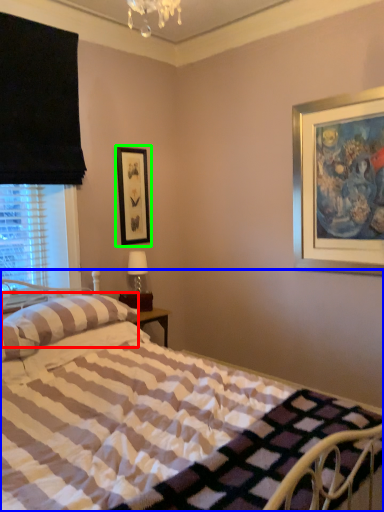
Question: Which object is positioned closest to pillow (highlighted by a red box)? Select from bed (highlighted by a blue box) and picture frame (highlighted by a green box).

Choices:
 (A) bed
 (B) picture frame

Answer: (A)